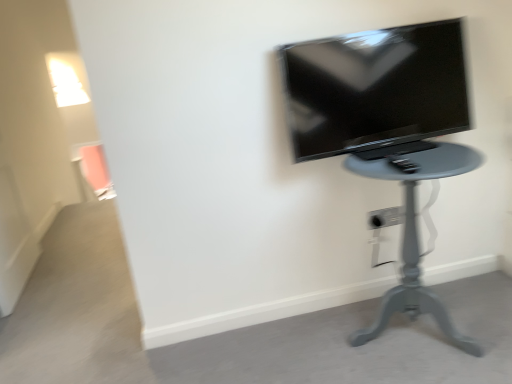
Image resolution: width=512 pixels, height=384 pixels. What do you see at coordinates (416, 232) in the screenshot?
I see `matte gray table at center` at bounding box center [416, 232].

What do you see at coordinates (375, 89) in the screenshot?
I see `matte black tv at upper right` at bounding box center [375, 89].

Image resolution: width=512 pixels, height=384 pixels. I want to click on white plastic electric outlet at lower center, so click(x=386, y=217).

Measure the distance from white plastic electric outlet at lower center to matte black tv at upper right.

white plastic electric outlet at lower center and matte black tv at upper right are 21.61 inches apart from each other.

From the image's perspective, would you say white plastic electric outlet at lower center is shown under matte black tv at upper right?

Correct, white plastic electric outlet at lower center appears lower than matte black tv at upper right in the image.

Looking at this image, considering the relative sizes of white plastic electric outlet at lower center and matte black tv at upper right in the image provided, is white plastic electric outlet at lower center taller than matte black tv at upper right?

Incorrect, the height of white plastic electric outlet at lower center is not larger of that of matte black tv at upper right.

How many degrees apart are the facing directions of white plastic electric outlet at lower center and matte black tv at upper right?

white plastic electric outlet at lower center and matte black tv at upper right are facing 0.42 degrees away from each other.

Who is shorter, matte gray table at center or white plastic electric outlet at lower center?

With less height is white plastic electric outlet at lower center.

Are matte gray table at center and white plastic electric outlet at lower center located far from each other?

No, matte gray table at center is not far from white plastic electric outlet at lower center.

Looking at this image, from a real-world perspective, is white plastic electric outlet at lower center positioned above or below matte gray table at center?

white plastic electric outlet at lower center is above matte gray table at center.

Considering the relative sizes of white plastic electric outlet at lower center and matte gray table at center in the image provided, is white plastic electric outlet at lower center taller than matte gray table at center?

In fact, white plastic electric outlet at lower center may be shorter than matte gray table at center.

Is white plastic electric outlet at lower center in front of or behind matte gray table at center in the image?

Clearly, white plastic electric outlet at lower center is behind matte gray table at center.

Who is bigger, white plastic electric outlet at lower center or matte gray table at center?

matte gray table at center is bigger.

This screenshot has width=512, height=384. I want to click on television that appears on the left of white plastic electric outlet at lower center, so click(375, 89).

From the image's perspective, is matte black tv at upper right on white plastic electric outlet at lower center?

Yes.

How distant is matte gray table at center from matte black tv at upper right?

The distance of matte gray table at center from matte black tv at upper right is 12.22 inches.

From the image's perspective, between matte gray table at center and matte black tv at upper right, who is located below?

matte gray table at center.

Is the depth of matte gray table at center greater than that of matte black tv at upper right?

That is False.

Is matte gray table at center facing towards matte black tv at upper right?

No, matte gray table at center is not facing towards matte black tv at upper right.

How different are the orientations of matte black tv at upper right and matte gray table at center in degrees?

The angular difference between matte black tv at upper right and matte gray table at center is 0.119 degrees.

From the image's perspective, between matte black tv at upper right and matte gray table at center, which one is located above?

matte black tv at upper right is shown above in the image.

Is matte black tv at upper right behind matte gray table at center?

Yes, it is.

Can you confirm if matte black tv at upper right is positioned to the right of matte gray table at center?

No.

Locate an element on the screen. The width and height of the screenshot is (512, 384). electric outlet behind the matte black tv at upper right is located at coordinates (386, 217).

The image size is (512, 384). I want to click on furniture below the white plastic electric outlet at lower center (from a real-world perspective), so click(x=416, y=232).

When comparing their distances from matte black tv at upper right, does white plastic electric outlet at lower center or matte gray table at center seem closer?

Based on the image, matte gray table at center appears to be nearer to matte black tv at upper right.

Considering their positions, is matte gray table at center positioned closer to matte black tv at upper right than white plastic electric outlet at lower center?

The object closer to matte black tv at upper right is matte gray table at center.

Based on their spatial positions, is white plastic electric outlet at lower center or matte black tv at upper right closer to matte gray table at center?

matte black tv at upper right lies closer to matte gray table at center than the other object.

When comparing their distances from white plastic electric outlet at lower center, does matte black tv at upper right or matte gray table at center seem further?

matte black tv at upper right.

Estimate the real-world distances between objects in this image. Which object is closer to matte gray table at center, matte black tv at upper right or white plastic electric outlet at lower center?

Based on the image, matte black tv at upper right appears to be nearer to matte gray table at center.

Which object lies further to the anchor point white plastic electric outlet at lower center, matte gray table at center or matte black tv at upper right?

matte black tv at upper right is further to white plastic electric outlet at lower center.

Find the location of a particular element. This screenshot has height=384, width=512. television located between matte gray table at center and white plastic electric outlet at lower center in the depth direction is located at coordinates (375, 89).